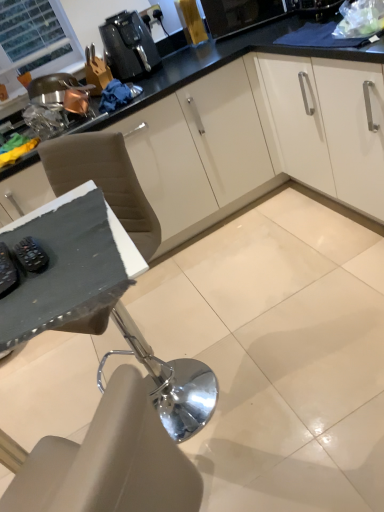
Question: Is black rubber remote control at lower left, which appears as the 2th appliance when viewed from the right, beside black plastic coffee machine at upper center?

Choices:
 (A) yes
 (B) no

Answer: (B)

Question: From the image's perspective, is black rubber remote control at lower left, which appears as the 2th appliance when viewed from the right, on black plastic coffee machine at upper center?

Choices:
 (A) no
 (B) yes

Answer: (A)

Question: Could you tell me if black rubber remote control at lower left, the first appliance viewed from the left, is turned towards black plastic coffee machine at upper center?

Choices:
 (A) yes
 (B) no

Answer: (B)

Question: From a real-world perspective, is black rubber remote control at lower left, the first appliance viewed from the left, positioned under black plastic coffee machine at upper center based on gravity?

Choices:
 (A) no
 (B) yes

Answer: (B)

Question: Is black rubber remote control at lower left, which appears as the 2th appliance when viewed from the right, to the left of black plastic coffee machine at upper center from the viewer's perspective?

Choices:
 (A) no
 (B) yes

Answer: (B)

Question: Is black rubber remote control at lower left, the first appliance viewed from the left, oriented away from black plastic coffee machine at upper center?

Choices:
 (A) no
 (B) yes

Answer: (A)

Question: Is black rubber remote control at left, which is the 1th appliance from right to left, aimed at black plastic coffee machine at upper center?

Choices:
 (A) no
 (B) yes

Answer: (A)

Question: From a real-world perspective, is black rubber remote control at left, which is the 1th appliance from right to left, on top of black plastic coffee machine at upper center?

Choices:
 (A) no
 (B) yes

Answer: (A)

Question: Does black rubber remote control at left, which is the 1th appliance from right to left, have a greater width compared to black plastic coffee machine at upper center?

Choices:
 (A) yes
 (B) no

Answer: (B)

Question: From the image's perspective, is black rubber remote control at left, the second appliance in the left-to-right sequence, under black plastic coffee machine at upper center?

Choices:
 (A) no
 (B) yes

Answer: (B)

Question: Can you confirm if black rubber remote control at left, which is the 1th appliance from right to left, is thinner than black plastic coffee machine at upper center?

Choices:
 (A) yes
 (B) no

Answer: (A)

Question: Are black rubber remote control at left, the second appliance in the left-to-right sequence, and black plastic coffee machine at upper center located far from each other?

Choices:
 (A) yes
 (B) no

Answer: (A)

Question: Does black plastic coffee machine at upper center appear on the left side of black rubber remote control at lower left, which appears as the 2th appliance when viewed from the right?

Choices:
 (A) yes
 (B) no

Answer: (B)